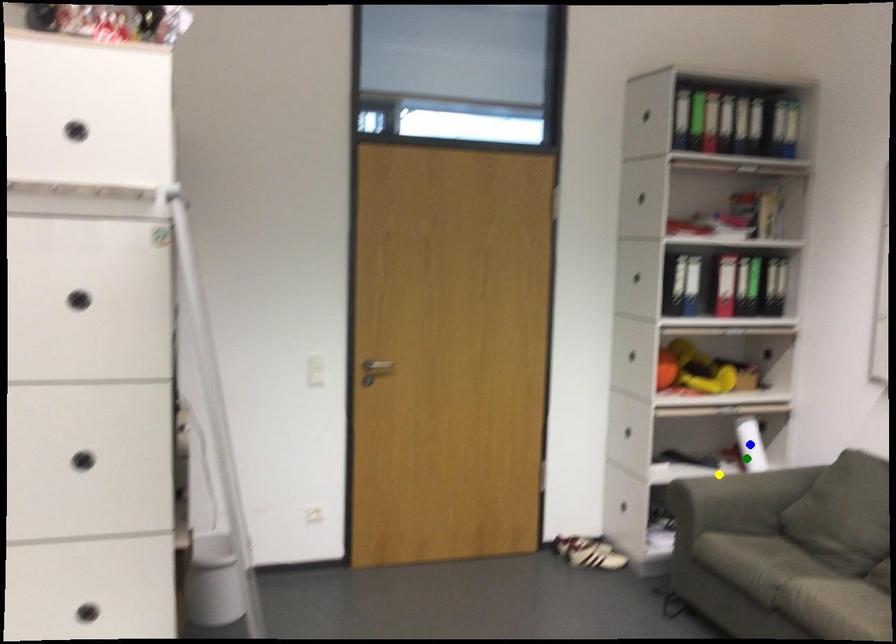
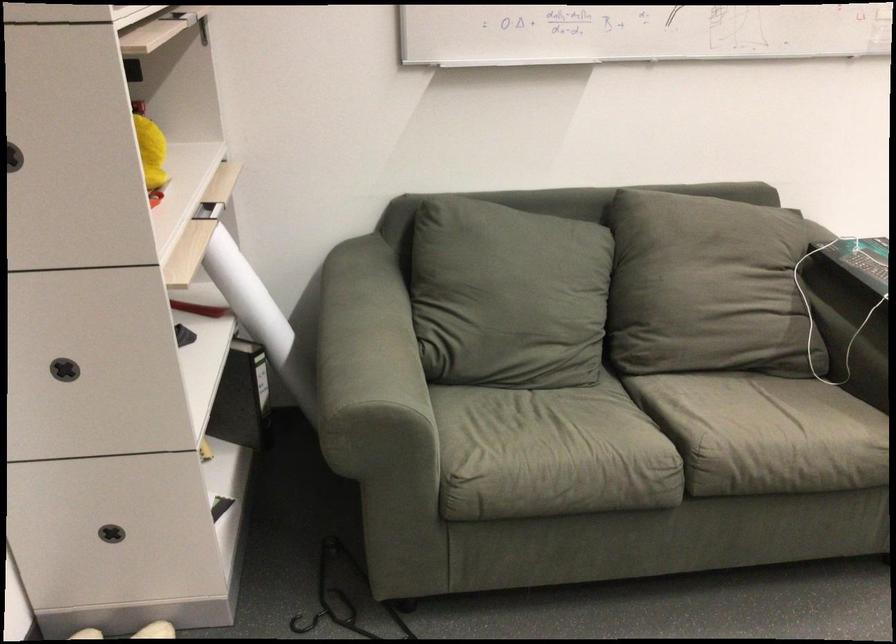
I am providing you with two images of the same scene from different viewpoints. Three points are marked in image1. Which point corresponds to a part or object that is occluded in image2?In image1, three points are marked. Which of them correspond to a part or object that is occluded in image2?Among the three points shown in image1, which one corresponds to a part or object that is no longer visible due to occlusion in image2?

Invisible in image2: blue point.